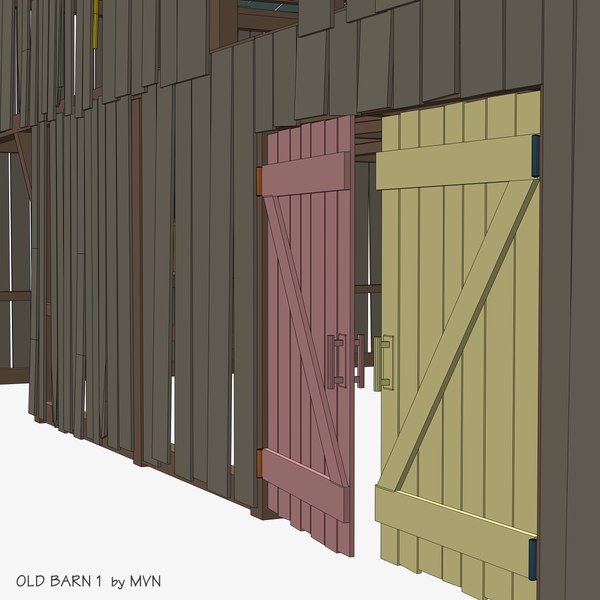
Where is `door handle`? The image size is (600, 600). door handle is located at coordinates (337, 375).